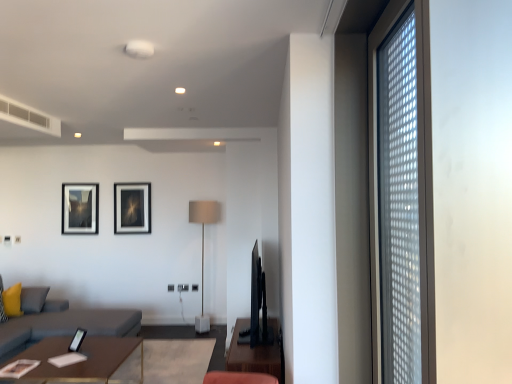
The image size is (512, 384). What do you see at coordinates (254, 355) in the screenshot?
I see `brown wooden table at center, positioned as the 2th table in left-to-right order` at bounding box center [254, 355].

This screenshot has height=384, width=512. What do you see at coordinates (132, 208) in the screenshot? I see `matte black picture frame at center, which appears as the 1th picture frame when viewed from the top` at bounding box center [132, 208].

The height and width of the screenshot is (384, 512). What do you see at coordinates (80, 362) in the screenshot?
I see `wooden table at lower left, acting as the second table starting from the right` at bounding box center [80, 362].

Where is `gray fabric couch at left`? The image size is (512, 384). gray fabric couch at left is located at coordinates (65, 325).

I want to click on matte black picture frame at upper left, which is counted as the 1th picture frame, starting from the left, so click(80, 208).

This screenshot has width=512, height=384. Describe the element at coordinates (12, 301) in the screenshot. I see `yellow fabric pillow at lower left` at that location.

At what (x,y) coordinates should I click in order to perform the action: click on brown wooden table at center, marked as the first table in a right-to-left arrangement. Please return your answer as a coordinate pair (x, y). The width and height of the screenshot is (512, 384). Looking at the image, I should click on (254, 355).

What's the angular difference between brown wooden table at center, positioned as the 2th table in left-to-right order, and matte black picture frame at lower center, the 3th picture frame from the left,'s facing directions?

55 degrees separate the facing orientations of brown wooden table at center, positioned as the 2th table in left-to-right order, and matte black picture frame at lower center, the 3th picture frame from the left.

In the scene shown: Is brown wooden table at center, positioned as the 2th table in left-to-right order, surrounding matte black picture frame at lower center, which ranks as the third picture frame in back-to-front order?

No, matte black picture frame at lower center, which ranks as the third picture frame in back-to-front order, is located outside of brown wooden table at center, positioned as the 2th table in left-to-right order.

From a real-world perspective, count 1st tables downward from the matte black picture frame at lower center, the 1th picture frame from the front, and point to it. Please provide its 2D coordinates.

[(254, 355)]

Could you tell me if brown wooden table at center, positioned as the 2th table in left-to-right order, is turned towards matte black picture frame at lower center, which ranks as the third picture frame in back-to-front order?

Yes, brown wooden table at center, positioned as the 2th table in left-to-right order, is aimed at matte black picture frame at lower center, which ranks as the third picture frame in back-to-front order.

Considering the relative sizes of wooden table at lower left, acting as the second table starting from the right, and transparent glass window at right in the image provided, is wooden table at lower left, acting as the second table starting from the right, taller than transparent glass window at right?

In fact, wooden table at lower left, acting as the second table starting from the right, may be shorter than transparent glass window at right.

Is transparent glass window at right surrounded by wooden table at lower left, acting as the second table starting from the right?

Actually, transparent glass window at right is outside wooden table at lower left, acting as the second table starting from the right.

Does wooden table at lower left, the 1th table when ordered from left to right, have a smaller size compared to transparent glass window at right?

No, wooden table at lower left, the 1th table when ordered from left to right, is not smaller than transparent glass window at right.

Which point is more forward, (53, 337) or (386, 275)?

Positioned in front is point (386, 275).

Which is more to the left, yellow fabric pillow at lower left or wooden table at lower left, the 1th table when ordered from left to right?

Positioned to the left is yellow fabric pillow at lower left.

Which table is the 1st one when counting from the right side of the yellow fabric pillow at lower left? Please provide its 2D coordinates.

[(80, 362)]

From a real-world perspective, who is located lower, yellow fabric pillow at lower left or wooden table at lower left, acting as the second table starting from the right?

From a 3D spatial view, wooden table at lower left, acting as the second table starting from the right, is below.

From the image's perspective, does yellow fabric pillow at lower left appear lower than wooden table at lower left, acting as the second table starting from the right?

No.

Is transparent glass window at right positioned far away from matte black picture frame at upper left, which is counted as the 1th picture frame, starting from the left?

Yes, transparent glass window at right is far from matte black picture frame at upper left, which is counted as the 1th picture frame, starting from the left.

Can you confirm if transparent glass window at right is thinner than matte black picture frame at upper left, which ranks as the third picture frame in front-to-back order?

No, transparent glass window at right is not thinner than matte black picture frame at upper left, which ranks as the third picture frame in front-to-back order.

From the image's perspective, which one is positioned lower, transparent glass window at right or matte black picture frame at upper left, acting as the second picture frame starting from the top?

matte black picture frame at upper left, acting as the second picture frame starting from the top, appears lower in the image.

Considering their positions, is brown wooden table at center, positioned as the 2th table in left-to-right order, located in front of or behind gray fabric couch at left?

brown wooden table at center, positioned as the 2th table in left-to-right order, is in front of gray fabric couch at left.

Which object is positioned more to the left, brown wooden table at center, positioned as the 2th table in left-to-right order, or gray fabric couch at left?

gray fabric couch at left is more to the left.

Does point (275, 320) come closer to viewer compared to point (38, 328)?

Yes, point (275, 320) is in front of point (38, 328).

The height and width of the screenshot is (384, 512). In order to click on the 1st table positioned below the yellow fabric pillow at lower left (from the image's perspective) in this screenshot , I will do `click(254, 355)`.

Between brown wooden table at center, marked as the first table in a right-to-left arrangement, and yellow fabric pillow at lower left, which one has smaller size?

With smaller size is yellow fabric pillow at lower left.

From a real-world perspective, is brown wooden table at center, positioned as the 2th table in left-to-right order, physically located above or below yellow fabric pillow at lower left?

From a real-world perspective, brown wooden table at center, positioned as the 2th table in left-to-right order, is physically below yellow fabric pillow at lower left.

Is brown wooden table at center, positioned as the 2th table in left-to-right order, taller than yellow fabric pillow at lower left?

Answer: Correct, brown wooden table at center, positioned as the 2th table in left-to-right order, is much taller as yellow fabric pillow at lower left.

Is gray fabric couch at left not near matte black picture frame at center, acting as the 2th picture frame starting from the right?

Yes, gray fabric couch at left is far from matte black picture frame at center, acting as the 2th picture frame starting from the right.

In the scene shown: Which is closer to the camera, (5, 358) or (136, 214)?

Point (5, 358) is positioned closer to the camera compared to point (136, 214).

Is gray fabric couch at left facing away from matte black picture frame at center, the 3th picture frame when ordered from bottom to top?

No.

Is matte black picture frame at center, acting as the 2th picture frame starting from the right, a part of gray fabric couch at left?

Actually, matte black picture frame at center, acting as the 2th picture frame starting from the right, is outside gray fabric couch at left.

Which picture frame is the 1st one when counting from the left side of the brown wooden table at center, marked as the first table in a right-to-left arrangement? Please provide its 2D coordinates.

[(77, 340)]

Locate an element on the screen. The width and height of the screenshot is (512, 384). window in front of the wooden table at lower left, the 1th table when ordered from left to right is located at coordinates (401, 196).

When comparing their distances from matte black picture frame at lower center, the 3th picture frame from the left, does brown wooden table at center, marked as the first table in a right-to-left arrangement, or wooden table at lower left, acting as the second table starting from the right, seem closer?

wooden table at lower left, acting as the second table starting from the right, lies closer to matte black picture frame at lower center, the 3th picture frame from the left, than the other object.

Which object lies nearer to the anchor point gray fabric couch at left, transparent glass window at right or matte black picture frame at upper left, the third picture frame viewed from the right?

Among the two, matte black picture frame at upper left, the third picture frame viewed from the right, is located nearer to gray fabric couch at left.

From the image, which object appears to be farther from yellow fabric pillow at lower left, brown wooden table at center, positioned as the 2th table in left-to-right order, or matte black picture frame at lower center, the 3th picture frame from the top?

Based on the image, brown wooden table at center, positioned as the 2th table in left-to-right order, appears to be further to yellow fabric pillow at lower left.

Which object lies further to the anchor point matte gray floor lamp at center, yellow fabric pillow at lower left or wooden table at lower left, acting as the second table starting from the right?

yellow fabric pillow at lower left.

From the image, which object appears to be farther from matte black picture frame at center, positioned as the 2th picture frame in front-to-back order, matte black picture frame at lower center, which appears as the first picture frame when viewed from the right, or matte gray floor lamp at center?

The object further to matte black picture frame at center, positioned as the 2th picture frame in front-to-back order, is matte black picture frame at lower center, which appears as the first picture frame when viewed from the right.

Which object lies further to the anchor point yellow fabric pillow at lower left, wooden table at lower left, acting as the second table starting from the right, or matte gray floor lamp at center?

The object further to yellow fabric pillow at lower left is matte gray floor lamp at center.

Which object lies nearer to the anchor point matte black picture frame at center, positioned as the 2th picture frame in front-to-back order, brown wooden table at center, marked as the first table in a right-to-left arrangement, or gray fabric couch at left?

gray fabric couch at left lies closer to matte black picture frame at center, positioned as the 2th picture frame in front-to-back order, than the other object.

When comparing their distances from matte gray floor lamp at center, does matte black picture frame at upper left, the third picture frame viewed from the right, or wooden table at lower left, acting as the second table starting from the right, seem closer?

Among the two, matte black picture frame at upper left, the third picture frame viewed from the right, is located nearer to matte gray floor lamp at center.

Where is `couch between wooden table at lower left, acting as the second table starting from the right, and matte gray floor lamp at center from front to back`? The width and height of the screenshot is (512, 384). couch between wooden table at lower left, acting as the second table starting from the right, and matte gray floor lamp at center from front to back is located at coordinates (65, 325).

Locate an element on the screen. picture frame positioned between matte black picture frame at lower center, which appears as the first picture frame when viewed from the right, and matte black picture frame at upper left, which is counted as the 1th picture frame, starting from the left, from near to far is located at coordinates (132, 208).

Find the location of a particular element. The image size is (512, 384). lamp positioned between matte black picture frame at lower center, the 1th picture frame from the front, and matte black picture frame at upper left, which is counted as the 1th picture frame, starting from the left, from near to far is located at coordinates (203, 248).

Where is `couch between wooden table at lower left, acting as the second table starting from the right, and matte black picture frame at center, acting as the 2th picture frame starting from the right, along the z-axis`? This screenshot has height=384, width=512. couch between wooden table at lower left, acting as the second table starting from the right, and matte black picture frame at center, acting as the 2th picture frame starting from the right, along the z-axis is located at coordinates (65, 325).